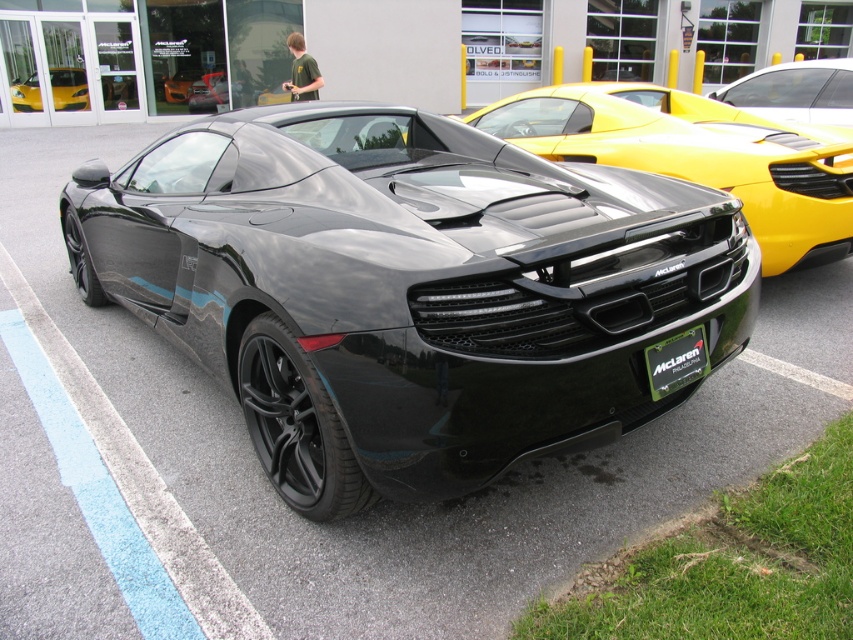
You are standing in the dealership lot and see the McLaren sports car at the center. There is a specific point marked at coordinates (212, 92). Can you tell me what object this point is located on?

The point at coordinates (212, 92) is located on the glossy black car at center.

You are standing at the front of the McLaren sports car and want to walk towards the dealership building. There are two points marked on the ground in front of you. Which point, point [210,92] or point [258,93], is closer to the dealership building?

Point [210,92] is behind point [258,93], so the closer point to the dealership building would be point [258,93].

You are a car enthusiast trying to identify the taller vehicle between the black carbon fiber sports car at center and the black matte sports car at center. Based on the scene description provided, which one is taller?

The black carbon fiber sports car at center is taller than the black matte sports car at center according to the description.